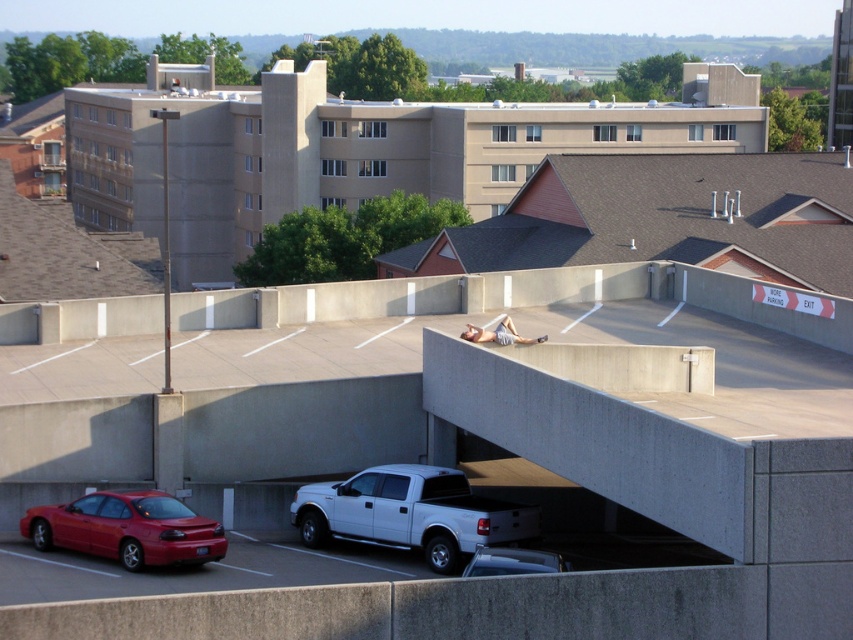
You are standing at the point with coordinates point (569,564) and want to walk to the point with coordinates point (390,513). Which direction should you move relative to the current position?

You should move forward because point (390,513) is behind point (569,564), meaning it is in the direction you are facing.

You are a delivery driver who needs to park your metallic silver truck at lower center in a spot that is directly under the concrete parking garage at upper center. Is there enough vertical clearance for the truck to pass under the garage structure?

The concrete parking garage at upper center is located above the metallic silver truck at lower center, which means there is sufficient vertical clearance for the truck to park directly underneath as the garage structure is elevated above it.